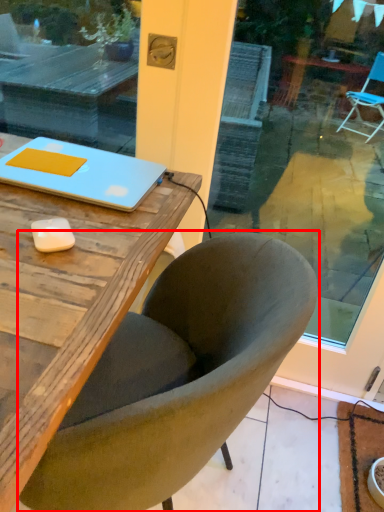
Question: From the image's perspective, what is the correct spatial relationship of chair (annotated by the red box) in relation to laptop?

Choices:
 (A) below
 (B) above

Answer: (A)